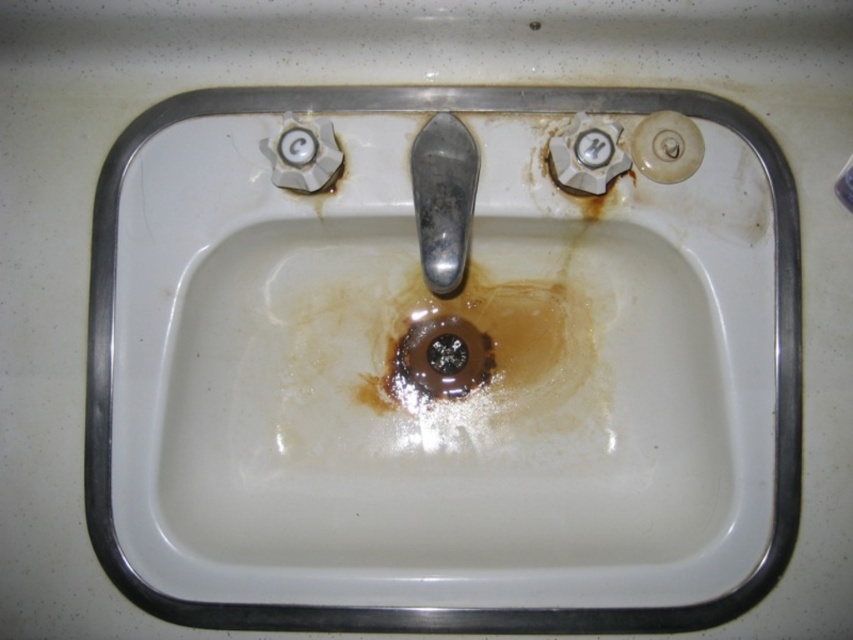
You are a plumber trying to locate the white porcelain sink at center in a room. According to the coordinates provided, where exactly is the sink positioned?

The white porcelain sink at center is located at point (444, 609), so it is positioned near the right side of the room since the x coordinate is close to 1.

You are a plumber trying to locate the shiny metallic faucet at center in the image. What are the coordinates of its position?

The coordinates of the shiny metallic faucet at center are at point (444,198).

You are a 3D scanning robot tasked with capturing the sink. You have two points to scan first, point (438, 244) and point (465, 330). Which point should you scan first to ensure proper depth mapping?

Point (438, 244) should be scanned first because it is closer to the camera than point (465, 330), ensuring accurate depth mapping starts from the nearest point.